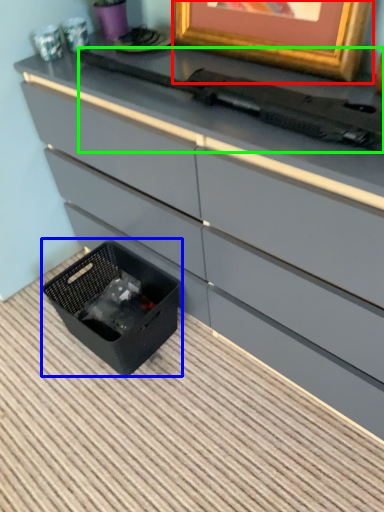
Question: Which is nearer to the picture frame (highlighted by a red box)? storage box (highlighted by a blue box) or typewriter (highlighted by a green box).

Choices:
 (A) storage box
 (B) typewriter

Answer: (B)